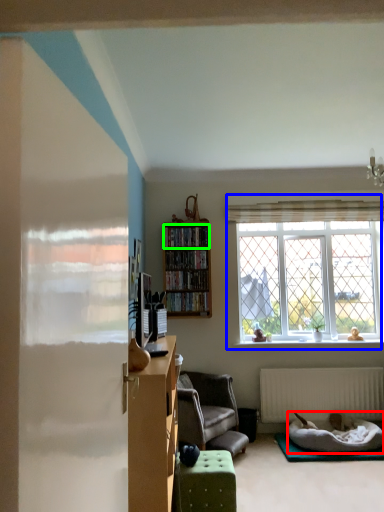
Question: Which is farther away from bedding (highlighted by a red box)? window (highlighted by a blue box) or cabinet (highlighted by a green box)?

Choices:
 (A) window
 (B) cabinet

Answer: (B)